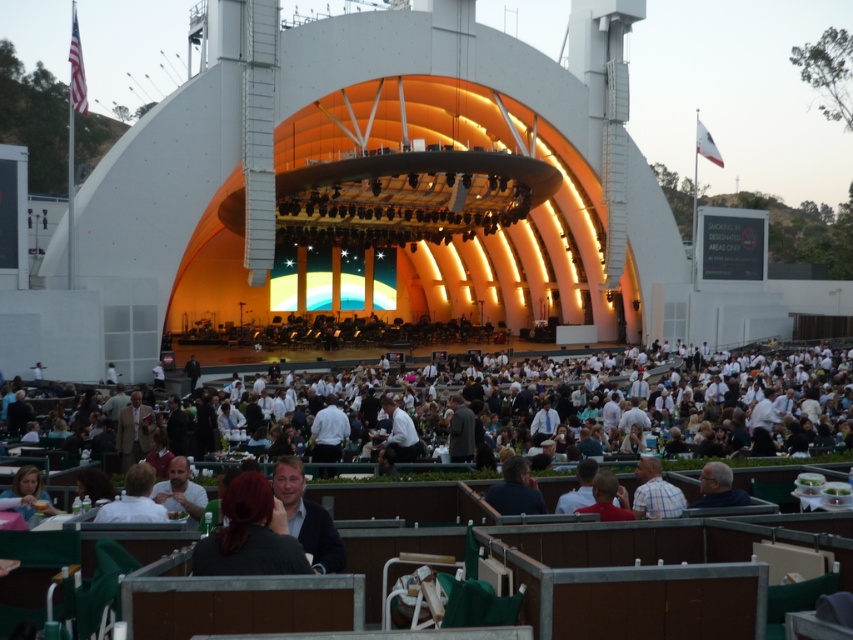
Who is higher up, matte black shirt at center or white shirt at center?

white shirt at center is higher up.

Can you confirm if matte black shirt at center is bigger than white shirt at center?

No.

Locate an element on the screen. matte black shirt at center is located at coordinates (180, 490).

Measure the distance from white shirt at lower center to white shirt at center.

The distance of white shirt at lower center from white shirt at center is 22.24 meters.

Does white shirt at lower center appear on the left side of white shirt at center?

Correct, you'll find white shirt at lower center to the left of white shirt at center.

Locate an element on the screen. The width and height of the screenshot is (853, 640). white shirt at lower center is located at coordinates (134, 499).

Who is positioned more to the left, white fabric shirt at center or dark gray sweater at lower center?

From the viewer's perspective, white fabric shirt at center appears more on the left side.

Measure the distance between point [340,428] and camera.

A distance of 65.98 meters exists between point [340,428] and camera.

This screenshot has width=853, height=640. Identify the location of white fabric shirt at center. (x=328, y=432).